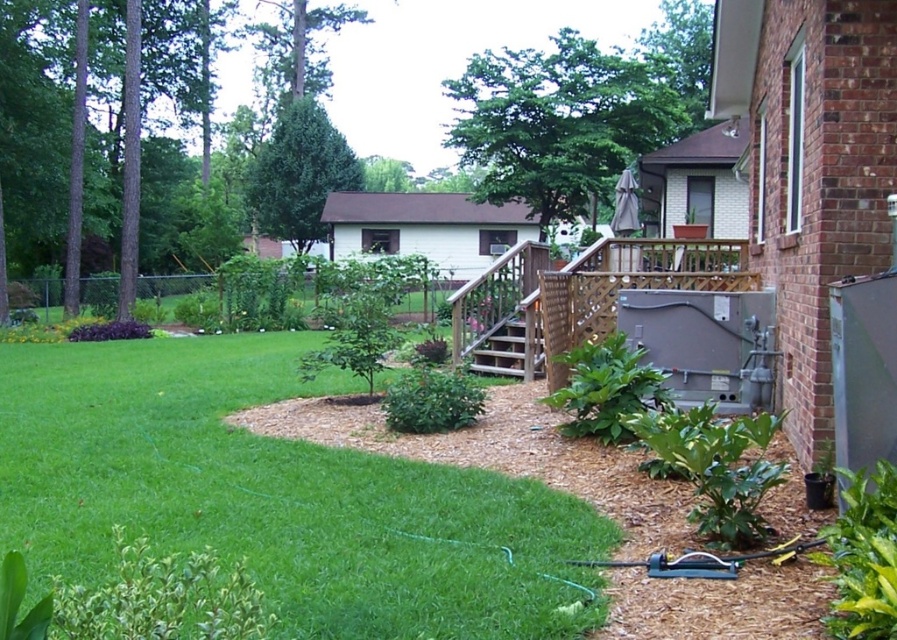
You are standing at the wooden staircase leading to the deck. You want to walk to the point marked at coordinates (275, 497). Which direction should you go relative to the staircase?

You should go to the lower left direction relative to the staircase because the point (275, 497) is on green grass at lower left.

You are standing at the bottom of the wooden staircase in the backyard. Looking towards the garden bed, where is the green grass at lower left located relative to the point marked at coordinates [275,497]?

The point marked at coordinates [275,497] corresponds to the green grass at lower left, so it is located exactly at that position.

You are standing in the backyard and want to determine the relative positions of two points marked in the scene. Which point is closer to you, point (x=155, y=451) or point (x=518, y=362)?

Point (x=155, y=451) is closer to the viewer than point (x=518, y=362).